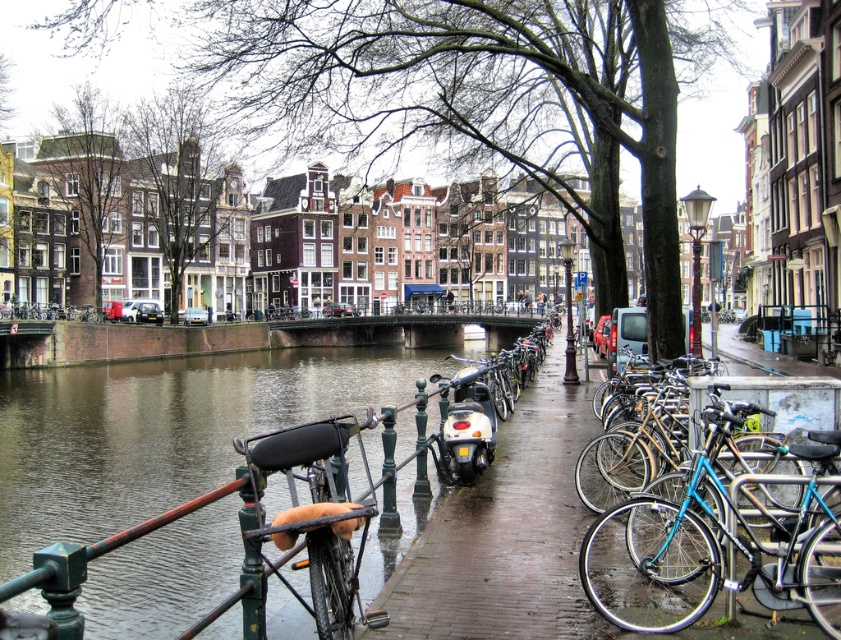
Question: Does brick pavement at center have a smaller size compared to blue metallic bicycle at right?

Choices:
 (A) yes
 (B) no

Answer: (B)

Question: Which point is farther to the camera?

Choices:
 (A) brick pavement at center
 (B) blue metallic bicycle at right

Answer: (A)

Question: Considering the relative positions of brick pavement at center and blue metallic bicycle at right in the image provided, where is brick pavement at center located with respect to blue metallic bicycle at right?

Choices:
 (A) below
 (B) above

Answer: (B)

Question: Which point appears closest to the camera in this image?

Choices:
 (A) (812, 630)
 (B) (750, 502)

Answer: (A)

Question: Does brick pavement at center have a smaller size compared to blue metallic bicycle at right?

Choices:
 (A) yes
 (B) no

Answer: (B)

Question: Which point appears farthest from the camera in this image?

Choices:
 (A) (833, 452)
 (B) (490, 488)

Answer: (B)